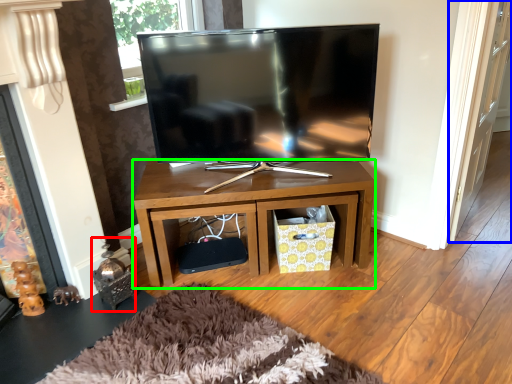
Question: Considering the real-world distances, which object is farthest from toy (highlighted by a red box)? glass door (highlighted by a blue box) or desk (highlighted by a green box)?

Choices:
 (A) glass door
 (B) desk

Answer: (A)